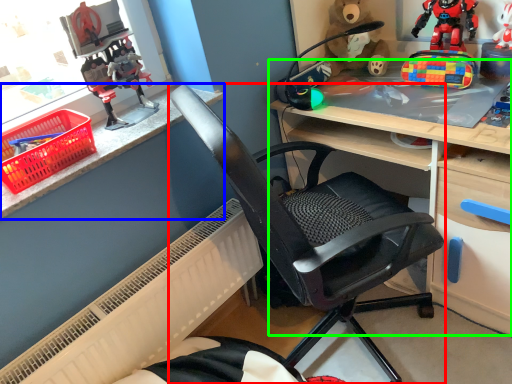
Question: Which is farther away from chair (highlighted by a red box)? counter top (highlighted by a blue box) or desk (highlighted by a green box)?

Choices:
 (A) counter top
 (B) desk

Answer: (A)